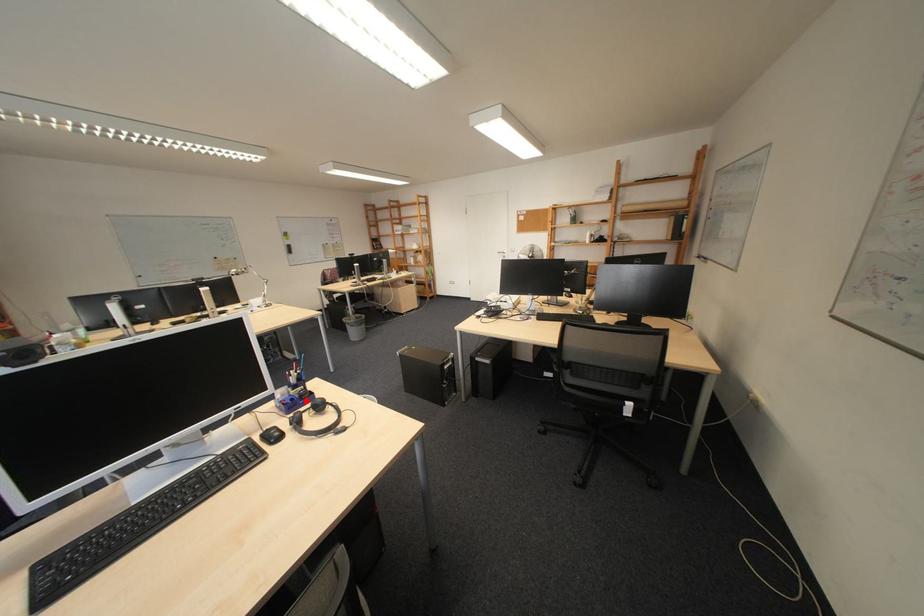
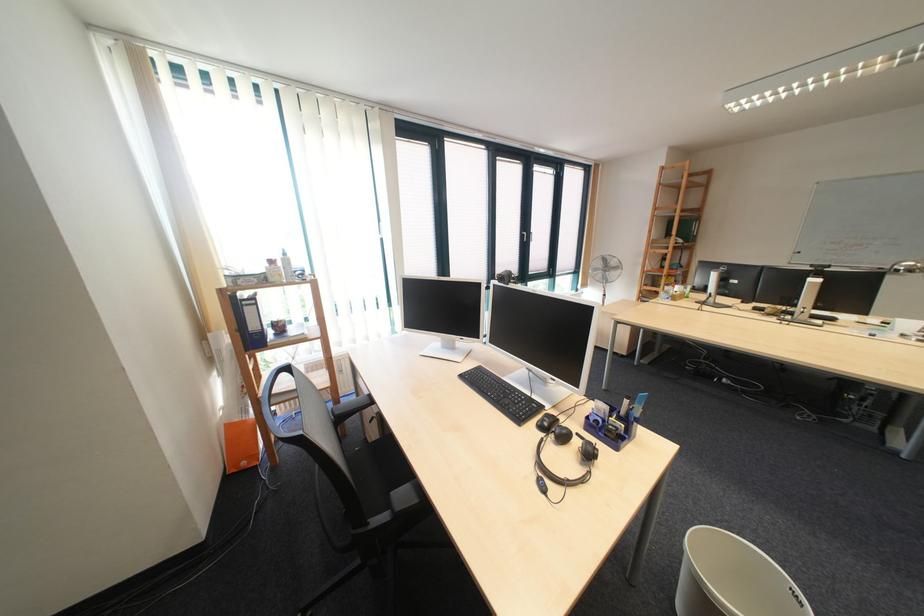
Question: I am providing you with two images of the same scene from different viewpoints. A red point is marked on the first image. Can you still see the location of the red point in image 2?

Choices:
 (A) Yes
 (B) No

Answer: (A)